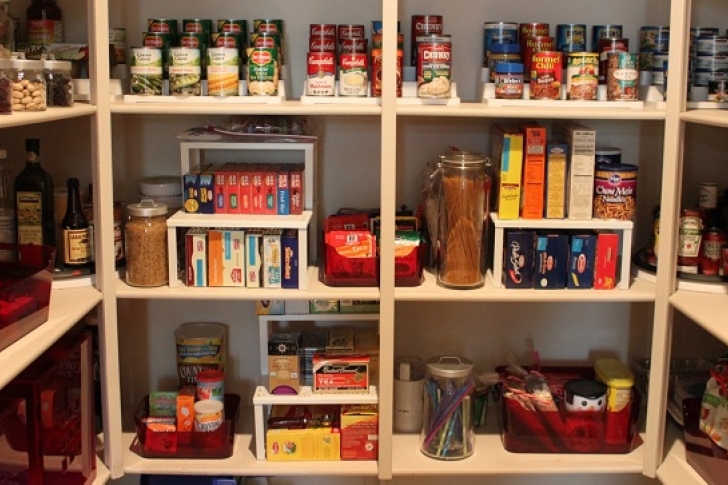
Where is `bottles`? The image size is (728, 485). bottles is located at coordinates (1, 214), (28, 201), (76, 226), (41, 18), (691, 227), (705, 201), (649, 251).